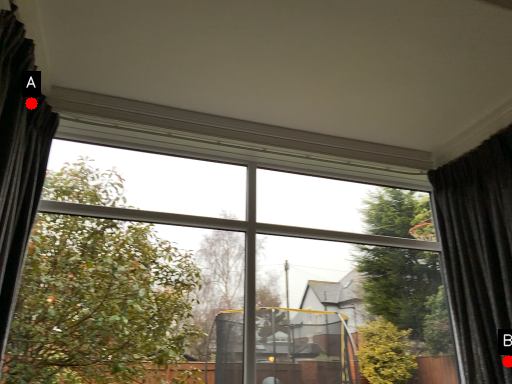
Question: Two points are circled on the image, labeled by A and B beside each circle. Which point is further to the camera?

Choices:
 (A) A is further
 (B) B is further

Answer: (B)